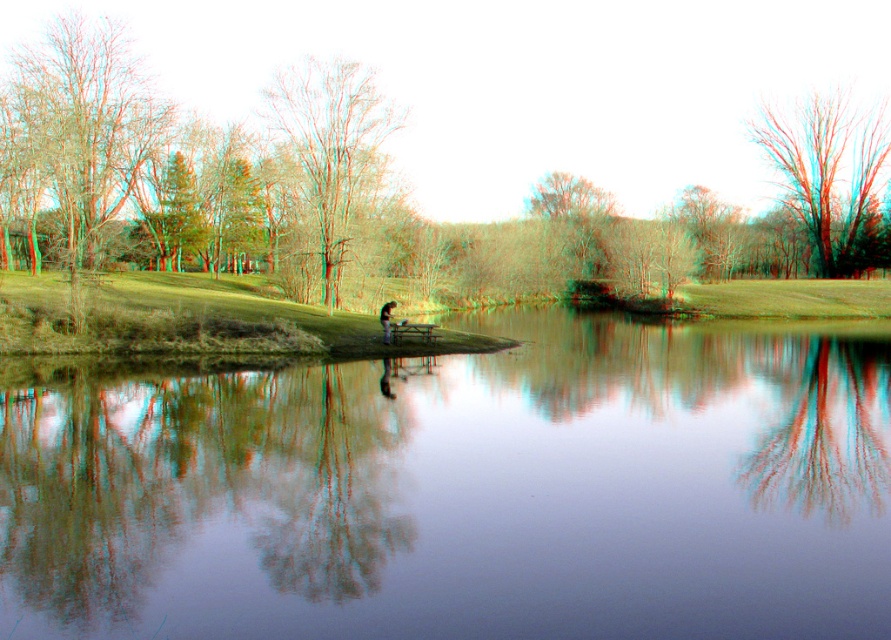
You are a photographer wanting to capture the smooth bark tree at upper right and the transparent glass water at center in your shot. Which object will be closer to the camera lens?

The smooth bark tree at upper right is positioned above the transparent glass water at center, so the smooth bark tree at upper right will be closer to the camera lens.

You are standing at the lakeside and want to take a photo of both point [154,141] and point [887,163] in the scene. Which point should you focus on first to ensure both are in clear view?

You should focus on point [154,141] first because it is closer to the camera than point [887,163], ensuring both points are in focus when using depth of field.